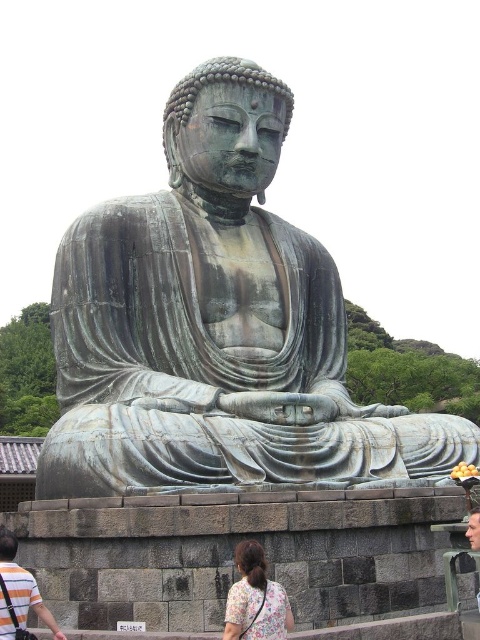
Question: Estimate the real-world distances between objects in this image. Which object is farther from the green patina bronze statue at center?

Choices:
 (A) striped cotton shirt at lower left
 (B) floral fabric dress at lower center

Answer: (A)

Question: Does green patina bronze statue at center appear over striped cotton shirt at lower left?

Choices:
 (A) yes
 (B) no

Answer: (A)

Question: Is green patina bronze statue at center to the right of striped cotton shirt at lower left from the viewer's perspective?

Choices:
 (A) no
 (B) yes

Answer: (B)

Question: Where is green patina bronze statue at center located in relation to striped cotton shirt at lower left in the image?

Choices:
 (A) below
 (B) above

Answer: (B)

Question: Which of the following is the farthest from the observer?

Choices:
 (A) (432, 465)
 (B) (12, 577)
 (C) (259, 544)

Answer: (A)

Question: Which object is farther from the camera taking this photo?

Choices:
 (A) green patina bronze statue at center
 (B) floral fabric dress at lower center

Answer: (A)